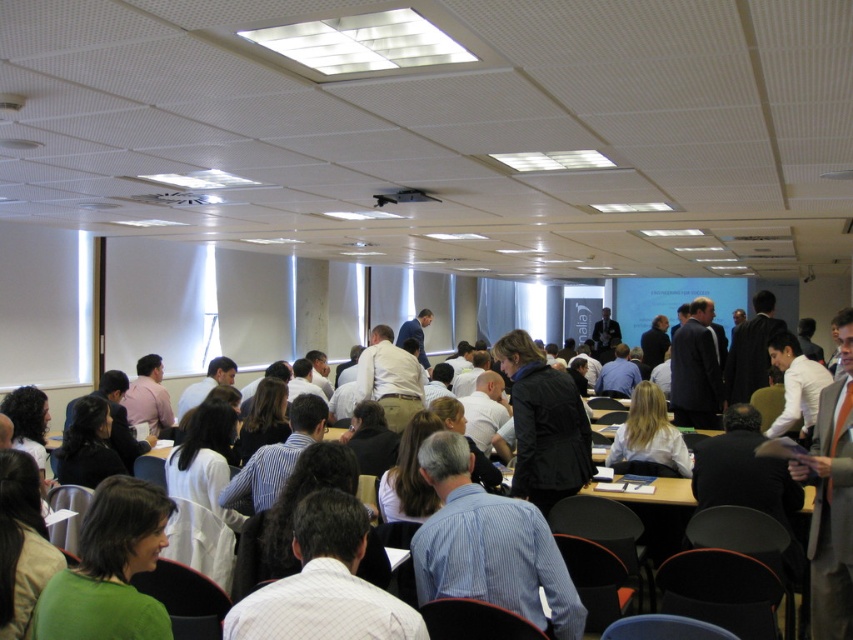
You are standing at point (114, 480) in the conference room and want to walk to the front of the room. If you walk straight ahead, will you encounter point (515, 600) before reaching the front?

Point (515, 600) is behind point (114, 480), so walking straight ahead towards the front, you would reach the front before encountering point (515, 600).

You are organizing a photo shoot in this conference room and want to position a camera to capture both the white striped shirt at center and the blonde hair at center. Since the camera has a limited field of view, you need to know which of the two is smaller to adjust the zoom accordingly. Which object is smaller?

The white striped shirt at center is smaller compared to the blonde hair at center, so you should adjust the camera zoom to focus on the white striped shirt at center first.